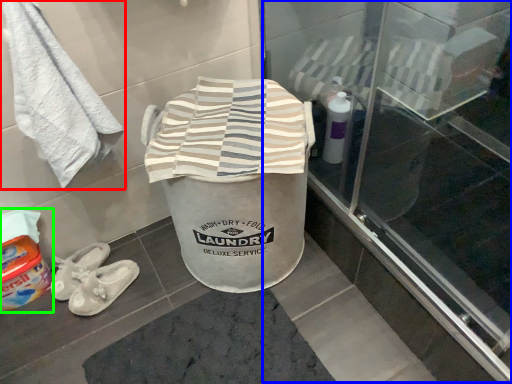
Question: Which object is the farthest from towel (highlighted by a red box)? Choose among these: screen door (highlighted by a blue box) or wash (highlighted by a green box).

Choices:
 (A) screen door
 (B) wash

Answer: (A)